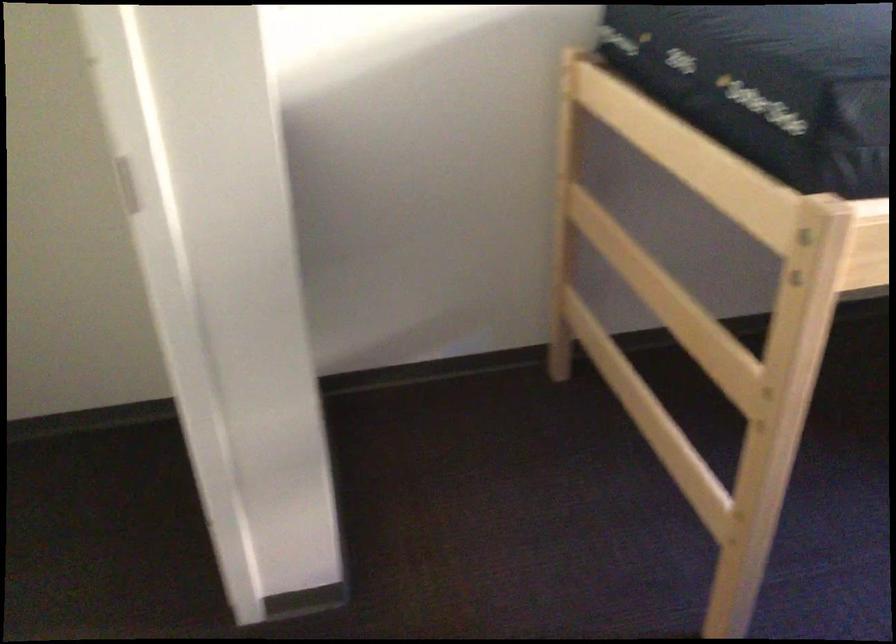
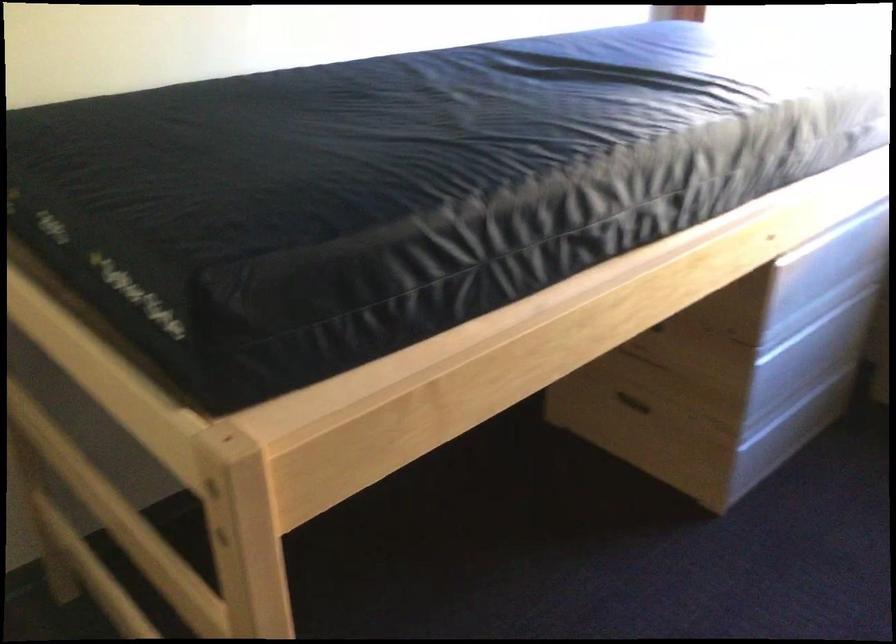
Question: The camera is either moving clockwise (left) or counter-clockwise (right) around the object. The first image is from the beginning of the video and the second image is from the end. Is the camera moving left or right when shooting the video?

Choices:
 (A) Left
 (B) Right

Answer: (A)